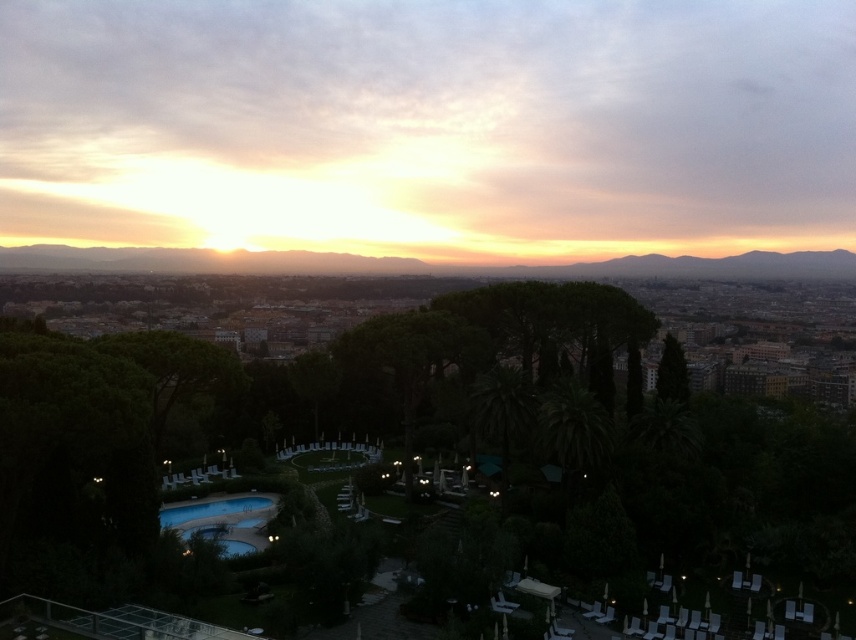
Does golden sky at center appear over blue glass pool at lower left?

Yes.

Which is above, golden sky at center or blue glass pool at lower left?

golden sky at center is higher up.

Between point (572, 273) and point (223, 522), which one is positioned behind?

Point (572, 273)

I want to click on golden sky at center, so click(418, 262).